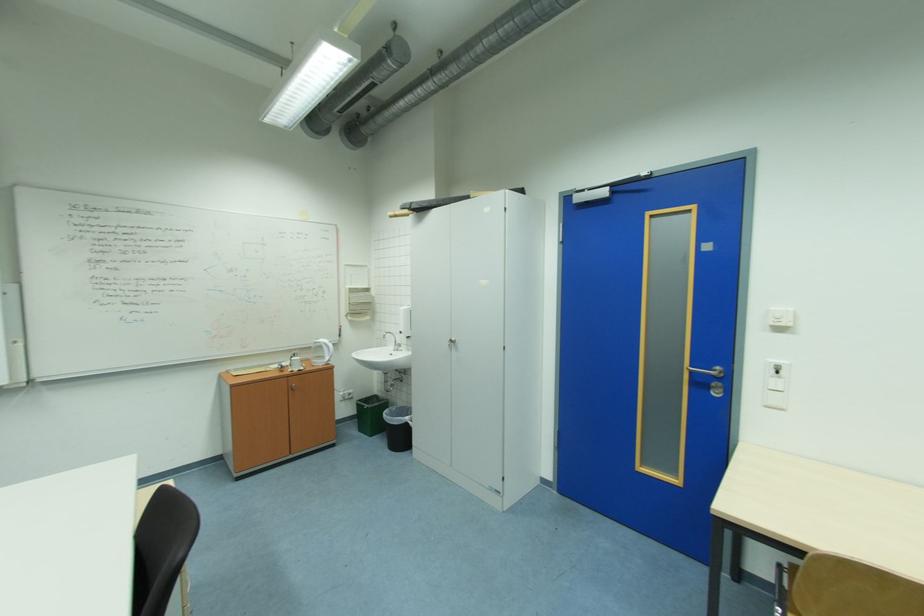
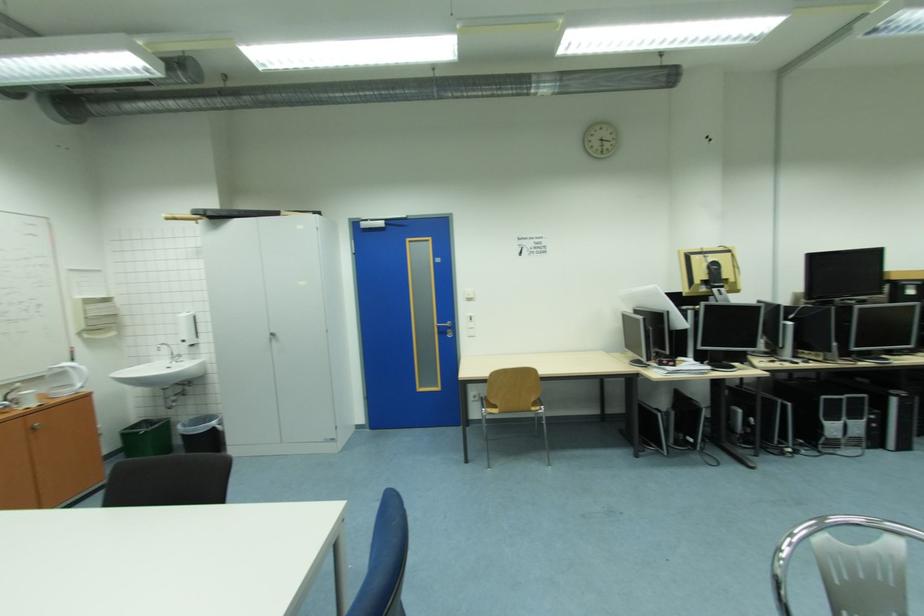
Find the pixel in the second image that matches [369,400] in the first image.

(130, 431)